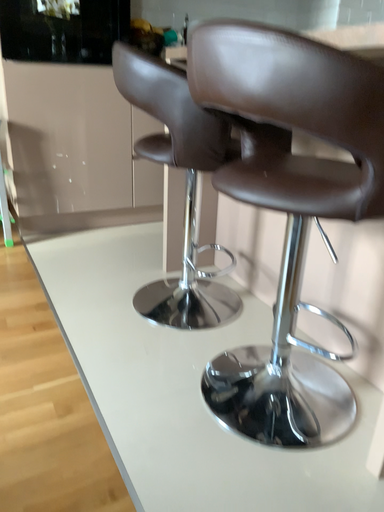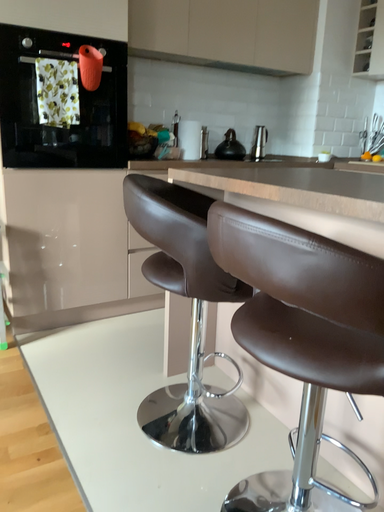
Question: Which way did the camera rotate in the video?

Choices:
 (A) rotated upward
 (B) rotated downward

Answer: (A)